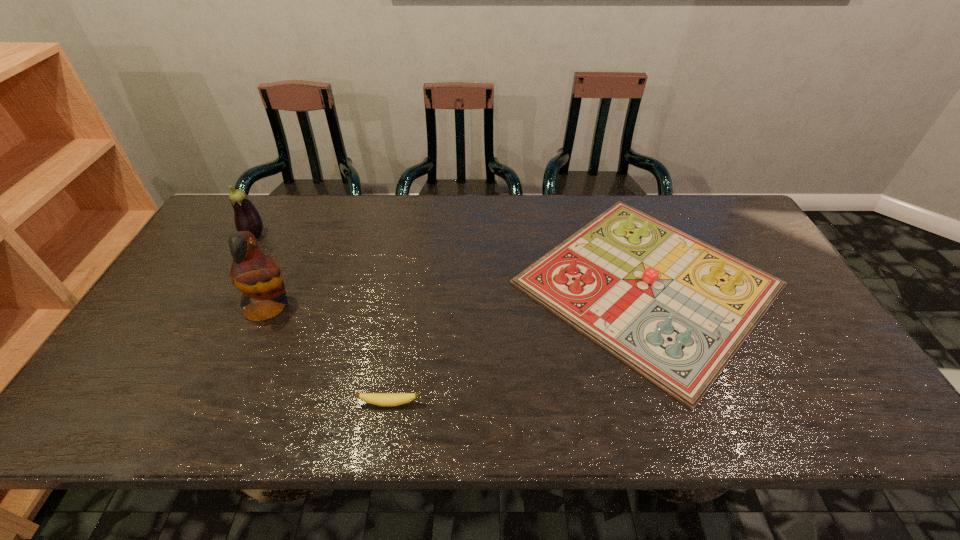
Find the location of `object that is at the near right corner`. object that is at the near right corner is located at coordinates (675, 309).

In the image, there is a desktop. Where is `vacant space at the far edge`? vacant space at the far edge is located at coordinates (515, 208).

I want to click on vacant space at the near edge of the desktop, so click(655, 402).

You are a GUI agent. You are given a task and a screenshot of the screen. Output one action in this format:
    pyautogui.click(x=<x>, y=<y>)
    Task: Click on the free space at the left edge of the desktop
    
    Given the screenshot: What is the action you would take?
    pyautogui.click(x=144, y=392)

In the image, there is a desktop. In order to click on free region at the right edge in this screenshot , I will do `click(797, 341)`.

Find the location of `vacant area at the near left corner`. vacant area at the near left corner is located at coordinates (130, 401).

I want to click on free space between the second tallest object and the rightmost object, so click(451, 260).

At what (x,y) coordinates should I click in order to perform the action: click on free space between the gameboard and the parrot. Please return your answer as a coordinate pair (x, y). Image resolution: width=960 pixels, height=540 pixels. Looking at the image, I should click on (458, 295).

You are a GUI agent. You are given a task and a screenshot of the screen. Output one action in this format:
    pyautogui.click(x=<x>, y=<y>)
    Task: Click on the free spot between the second object from left to right and the banana
    This screenshot has height=540, width=960.
    Given the screenshot: What is the action you would take?
    pyautogui.click(x=329, y=355)

Where is `free space between the gameboard and the leftmost object`? free space between the gameboard and the leftmost object is located at coordinates (451, 260).